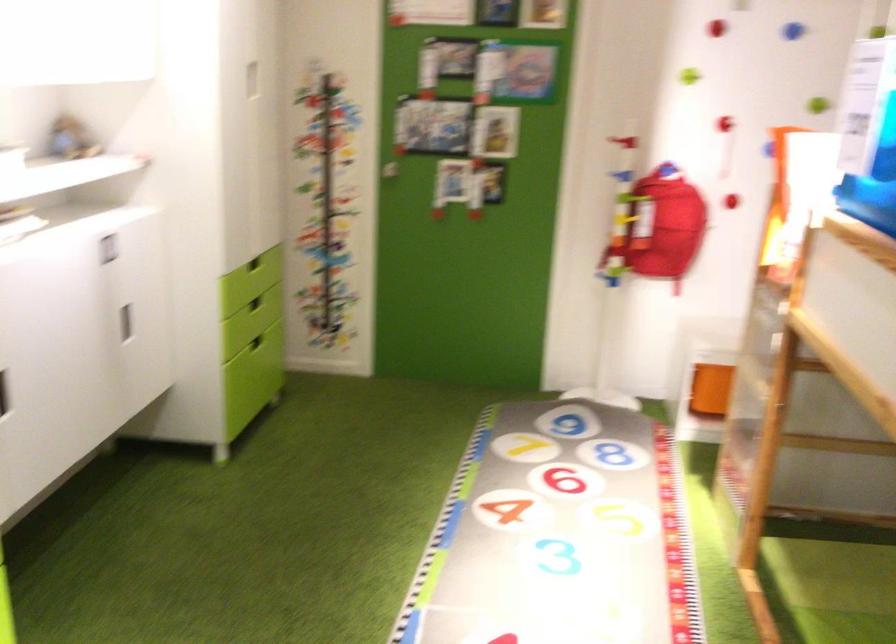
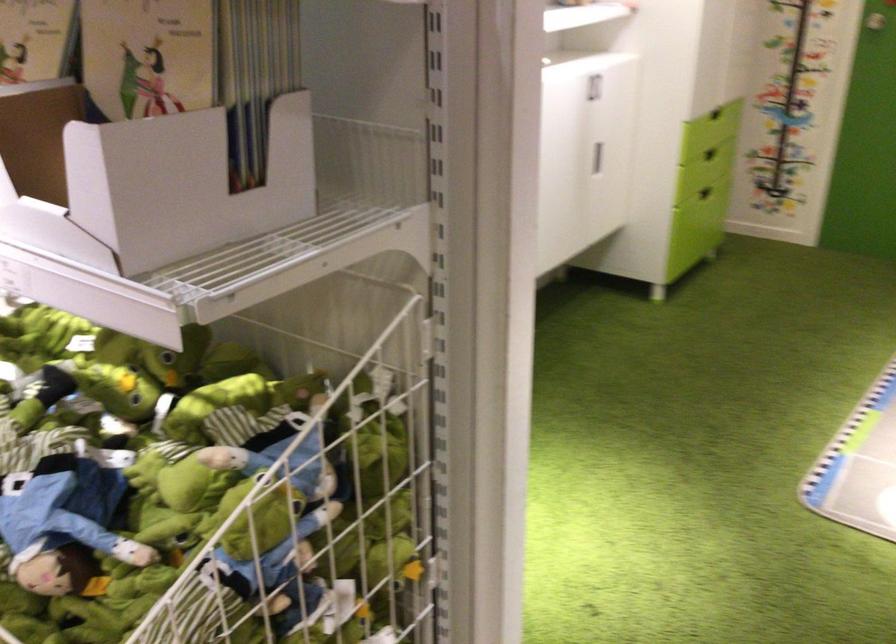
Question: I am providing you with two images of the same scene from different viewpoints. After the viewpoint changes to image2, which objects are now occluded?

Choices:
 (A) white cabinet handle
 (B) stuffed frog toy
 (C) gray and red shoe
 (D) green drawer handle

Answer: (A)